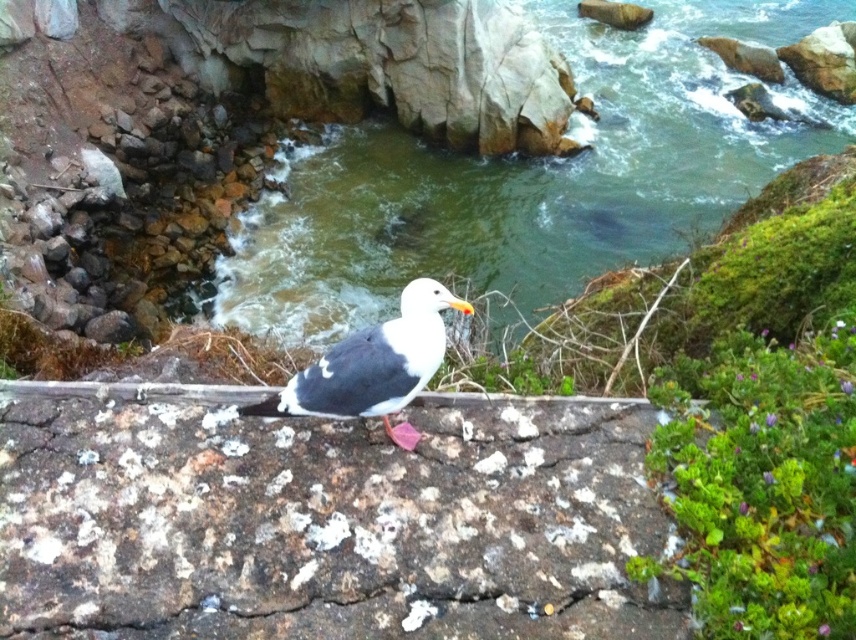
Question: In this image, where is speckled rock at center located relative to white matte bird at center?

Choices:
 (A) left
 (B) right

Answer: (A)

Question: Which of the following is the farthest from the observer?

Choices:
 (A) white matte bird at center
 (B) greenish water at center

Answer: (B)

Question: Which is nearer to the white matte bird at center?

Choices:
 (A) speckled rock at center
 (B) greenish water at center

Answer: (A)

Question: Is speckled rock at center bigger than white matte bird at center?

Choices:
 (A) no
 (B) yes

Answer: (B)

Question: Does greenish water at center appear on the left side of white matte bird at center?

Choices:
 (A) no
 (B) yes

Answer: (A)

Question: Among these objects, which one is nearest to the camera?

Choices:
 (A) white matte bird at center
 (B) speckled rock at center
 (C) greenish water at center

Answer: (B)